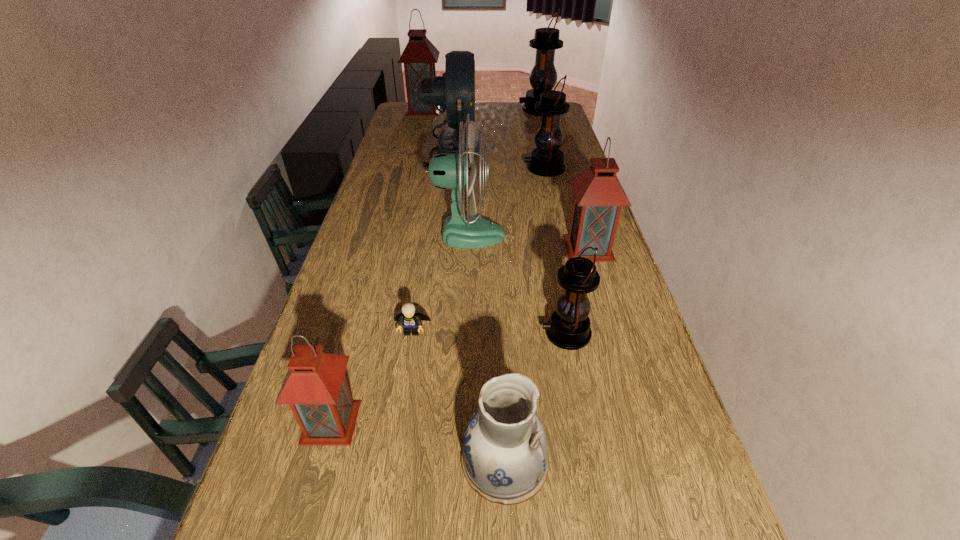
Where is `lantern that stands as the fourth closest to the farthest black lantern`? The width and height of the screenshot is (960, 540). lantern that stands as the fourth closest to the farthest black lantern is located at coordinates (568, 328).

This screenshot has height=540, width=960. I want to click on the second closest black lantern relative to the Lego, so click(x=546, y=160).

Identify which black lantern is the second closest to the farthest pink lantern. Please provide its 2D coordinates. Your answer should be formatted as a tuple, i.e. [(x, y)], where the tuple contains the x and y coordinates of a point satisfying the conditions above.

[(546, 160)]

Locate which pink lantern ranks second in proximity to the biggest pink lantern. Please provide its 2D coordinates. Your answer should be formatted as a tuple, i.e. [(x, y)], where the tuple contains the x and y coordinates of a point satisfying the conditions above.

[(315, 387)]

Point out which pink lantern is positioned as the second nearest to the blue pottery. Please provide its 2D coordinates. Your answer should be formatted as a tuple, i.e. [(x, y)], where the tuple contains the x and y coordinates of a point satisfying the conditions above.

[(599, 196)]

This screenshot has width=960, height=540. I want to click on free space in the image that satisfies the following two spatial constraints: 1. on the front side of the farthest pink lantern; 2. on the right side of the third nearest lantern, so click(x=387, y=247).

The height and width of the screenshot is (540, 960). Identify the location of blank area in the image that satisfies the following two spatial constraints: 1. above the nearest black lantern, indicating its light source; 2. on the front side of the nearest pink lantern. (584, 422).

Where is `vacant space that satisfies the following two spatial constraints: 1. above the second smallest black lantern, indicating its light source; 2. on the front side of the blue pottery`? vacant space that satisfies the following two spatial constraints: 1. above the second smallest black lantern, indicating its light source; 2. on the front side of the blue pottery is located at coordinates (612, 461).

Identify the location of blank area in the image that satisfies the following two spatial constraints: 1. above the fourth farthest lantern, indicating its light source; 2. on the left side of the biggest black lantern. The height and width of the screenshot is (540, 960). (576, 247).